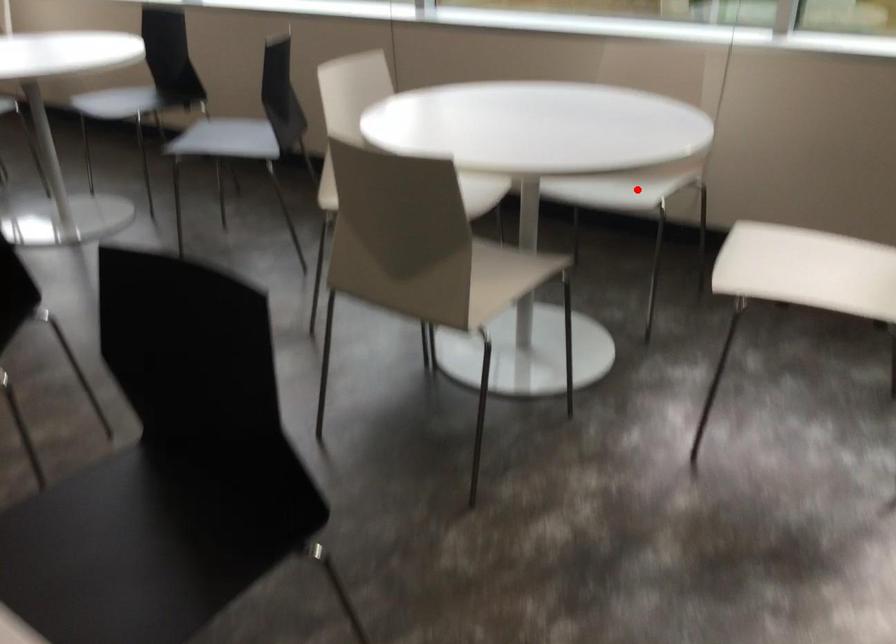
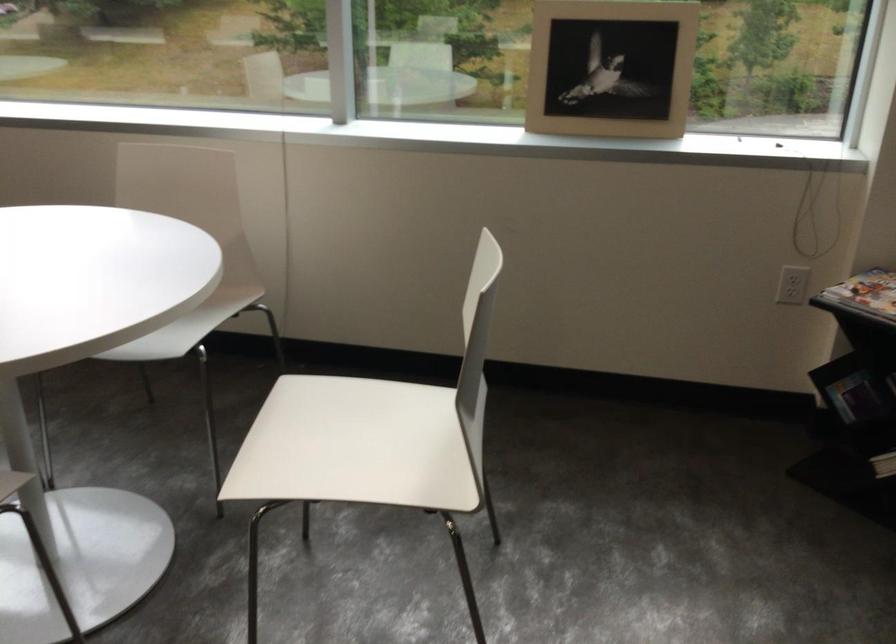
Question: I am providing you with two images of the same scene from different viewpoints. In image1, a red point is highlighted. Considering the same 3D point in image2, which of the following is correct?

Choices:
 (A) It is closer
 (B) It is farther

Answer: (A)